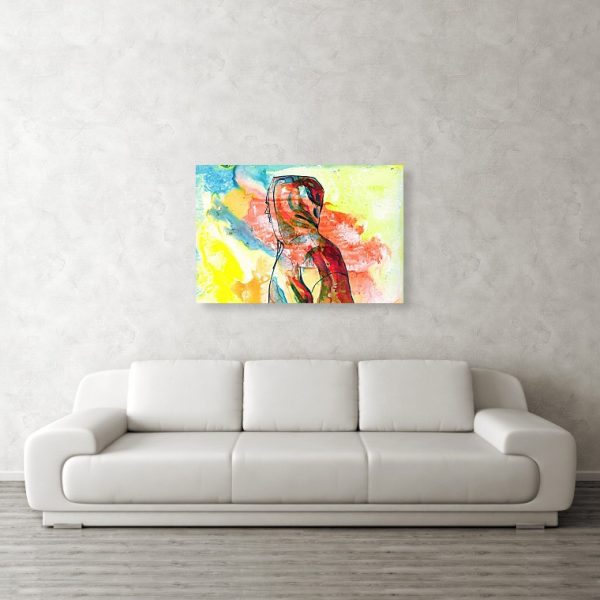
Where is `seat`? seat is located at coordinates (149, 437).